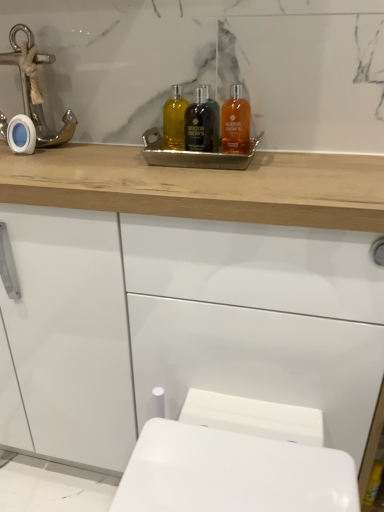
Question: Considering the relative positions of white glossy porcelain at lower center and translucent amber liquid at upper center, the third mouthwash viewed from the left, in the image provided, is white glossy porcelain at lower center to the right of translucent amber liquid at upper center, the third mouthwash viewed from the left, from the viewer's perspective?

Choices:
 (A) yes
 (B) no

Answer: (A)

Question: Is translucent amber liquid at upper center, the third mouthwash viewed from the left, surrounded by white glossy porcelain at lower center?

Choices:
 (A) no
 (B) yes

Answer: (A)

Question: From the image's perspective, does white glossy porcelain at lower center appear higher than translucent amber liquid at upper center, the 1th mouthwash when ordered from right to left?

Choices:
 (A) no
 (B) yes

Answer: (A)

Question: Does white glossy porcelain at lower center have a larger size compared to translucent amber liquid at upper center, the third mouthwash viewed from the left?

Choices:
 (A) yes
 (B) no

Answer: (A)

Question: Can you see white glossy porcelain at lower center touching translucent amber liquid at upper center, the 1th mouthwash when ordered from right to left?

Choices:
 (A) no
 (B) yes

Answer: (A)

Question: From the image's perspective, is translucent amber liquid at center, the 1th mouthwash positioned from the left, above or below black glass bottle at center, arranged as the 2th mouthwash when viewed from the left?

Choices:
 (A) above
 (B) below

Answer: (A)

Question: From a real-world perspective, relative to black glass bottle at center, the 2th mouthwash from the right, is translucent amber liquid at center, the 1th mouthwash positioned from the left, vertically above or below?

Choices:
 (A) above
 (B) below

Answer: (B)

Question: Considering the positions of translucent amber liquid at center, the 1th mouthwash positioned from the left, and black glass bottle at center, arranged as the 2th mouthwash when viewed from the left, in the image, is translucent amber liquid at center, the 1th mouthwash positioned from the left, wider or thinner than black glass bottle at center, arranged as the 2th mouthwash when viewed from the left,?

Choices:
 (A) thin
 (B) wide

Answer: (B)

Question: Considering the positions of translucent amber liquid at center, marked as the 3th mouthwash in a right-to-left arrangement, and black glass bottle at center, arranged as the 2th mouthwash when viewed from the left, in the image, is translucent amber liquid at center, marked as the 3th mouthwash in a right-to-left arrangement, taller or shorter than black glass bottle at center, arranged as the 2th mouthwash when viewed from the left,?

Choices:
 (A) short
 (B) tall

Answer: (A)

Question: Choose the correct answer: Is black glass bottle at center, arranged as the 2th mouthwash when viewed from the left, inside metallic tray at center or outside it?

Choices:
 (A) inside
 (B) outside

Answer: (A)

Question: Is black glass bottle at center, the 2th mouthwash from the right, to the left or to the right of metallic tray at center in the image?

Choices:
 (A) left
 (B) right

Answer: (B)

Question: Based on their sizes in the image, would you say black glass bottle at center, arranged as the 2th mouthwash when viewed from the left, is bigger or smaller than metallic tray at center?

Choices:
 (A) big
 (B) small

Answer: (B)

Question: Is black glass bottle at center, arranged as the 2th mouthwash when viewed from the left, in front of or behind metallic tray at center in the image?

Choices:
 (A) behind
 (B) front

Answer: (A)

Question: Is white glossy porcelain at lower center inside or outside of metallic anchor at left?

Choices:
 (A) inside
 (B) outside

Answer: (B)

Question: From a real-world perspective, is white glossy porcelain at lower center physically located above or below metallic anchor at left?

Choices:
 (A) below
 (B) above

Answer: (A)